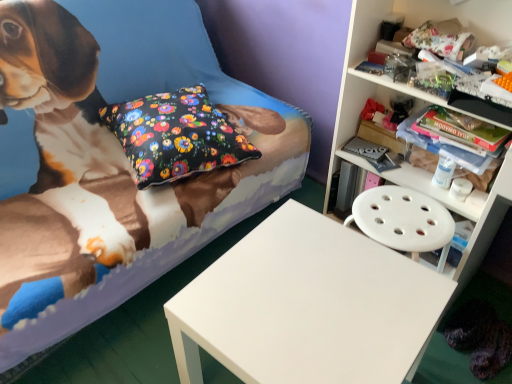
Question: Is white matte table at center in front of fluffy fabric bed at center?

Choices:
 (A) yes
 (B) no

Answer: (B)

Question: Does white matte table at center contain fluffy fabric bed at center?

Choices:
 (A) yes
 (B) no

Answer: (B)

Question: Does white matte table at center have a larger size compared to fluffy fabric bed at center?

Choices:
 (A) no
 (B) yes

Answer: (A)

Question: Is white matte table at center completely or partially outside of fluffy fabric bed at center?

Choices:
 (A) no
 (B) yes

Answer: (B)

Question: Is the depth of white matte table at center greater than that of fluffy fabric bed at center?

Choices:
 (A) yes
 (B) no

Answer: (A)

Question: Does white matte table at center have a lesser width compared to fluffy fabric bed at center?

Choices:
 (A) no
 (B) yes

Answer: (B)

Question: Is floral fabric pillow at center positioned with its back to white matte table at center?

Choices:
 (A) yes
 (B) no

Answer: (B)

Question: Does floral fabric pillow at center appear on the right side of white matte table at center?

Choices:
 (A) no
 (B) yes

Answer: (A)

Question: Considering the relative positions of floral fabric pillow at center and white matte table at center in the image provided, is floral fabric pillow at center to the left of white matte table at center from the viewer's perspective?

Choices:
 (A) yes
 (B) no

Answer: (A)

Question: Is floral fabric pillow at center completely or partially outside of white matte table at center?

Choices:
 (A) no
 (B) yes

Answer: (B)

Question: Can you confirm if floral fabric pillow at center is wider than white matte table at center?

Choices:
 (A) no
 (B) yes

Answer: (B)

Question: From a real-world perspective, is floral fabric pillow at center under white matte table at center?

Choices:
 (A) yes
 (B) no

Answer: (B)

Question: Can you confirm if white matte table at center is positioned to the right of white plastic shelf at upper right?

Choices:
 (A) no
 (B) yes

Answer: (A)